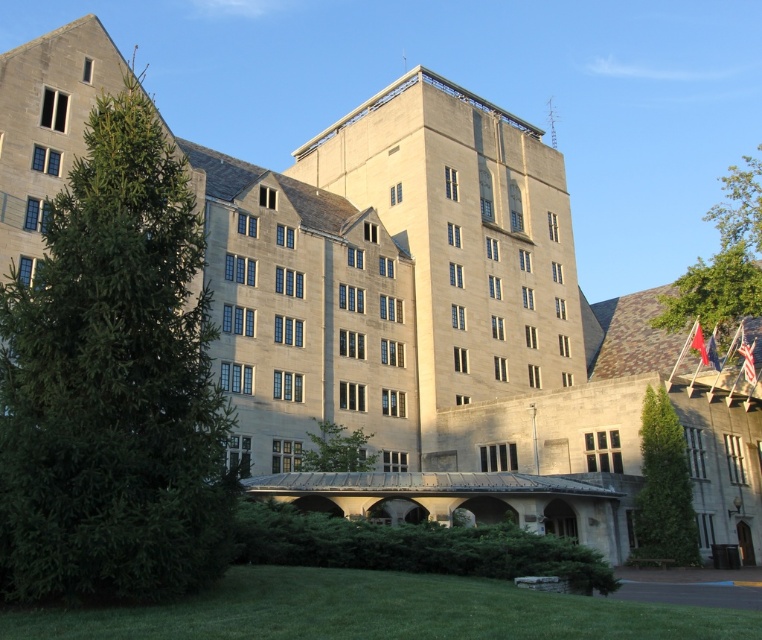
Question: Can you confirm if green grass at lower center is smaller than green leafy tree at lower right?

Choices:
 (A) yes
 (B) no

Answer: (B)

Question: Can you confirm if green leafy tree at left is positioned below green leafy tree at center?

Choices:
 (A) no
 (B) yes

Answer: (A)

Question: Observing the image, what is the correct spatial positioning of green leafy tree at left in reference to green leafy tree at upper right?

Choices:
 (A) right
 (B) left

Answer: (B)

Question: Which point is closer to the camera?

Choices:
 (A) green grass at lower center
 (B) green leafy tree at left

Answer: (A)

Question: Which of the following is the closest to the observer?

Choices:
 (A) green grass at lower center
 (B) green leafy tree at upper right

Answer: (A)

Question: Among these points, which one is farthest from the camera?

Choices:
 (A) (668, 470)
 (B) (190, 272)

Answer: (A)